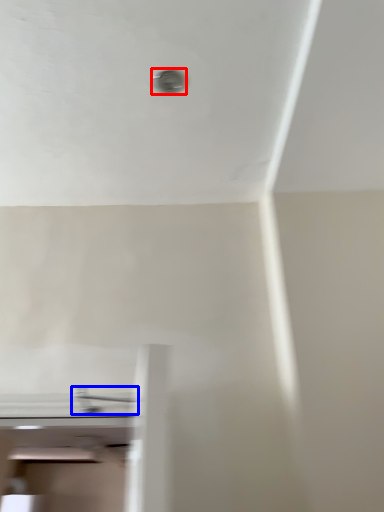
Question: Which object appears closest to the camera in this image, hole (highlighted by a red box) or tap (highlighted by a blue box)?

Choices:
 (A) hole
 (B) tap

Answer: (B)